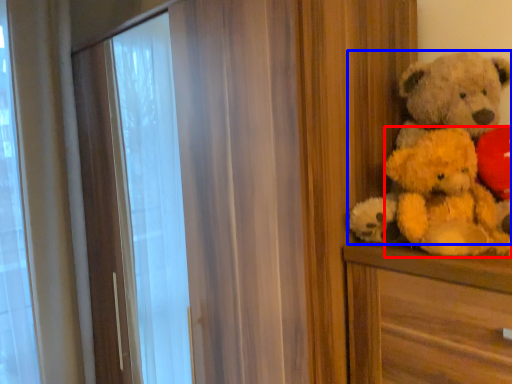
Question: Which point is closer to the camera, teddy (highlighted by a red box) or teddy bear (highlighted by a blue box)?

Choices:
 (A) teddy
 (B) teddy bear

Answer: (A)